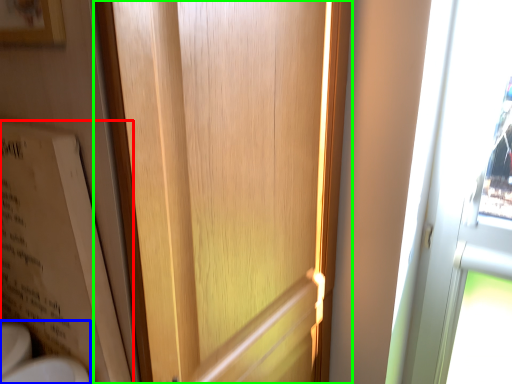
Question: Which object is positioned closest to bulletin board (highlighted by a red box)? Select from sink (highlighted by a blue box) and door (highlighted by a green box).

Choices:
 (A) sink
 (B) door

Answer: (A)